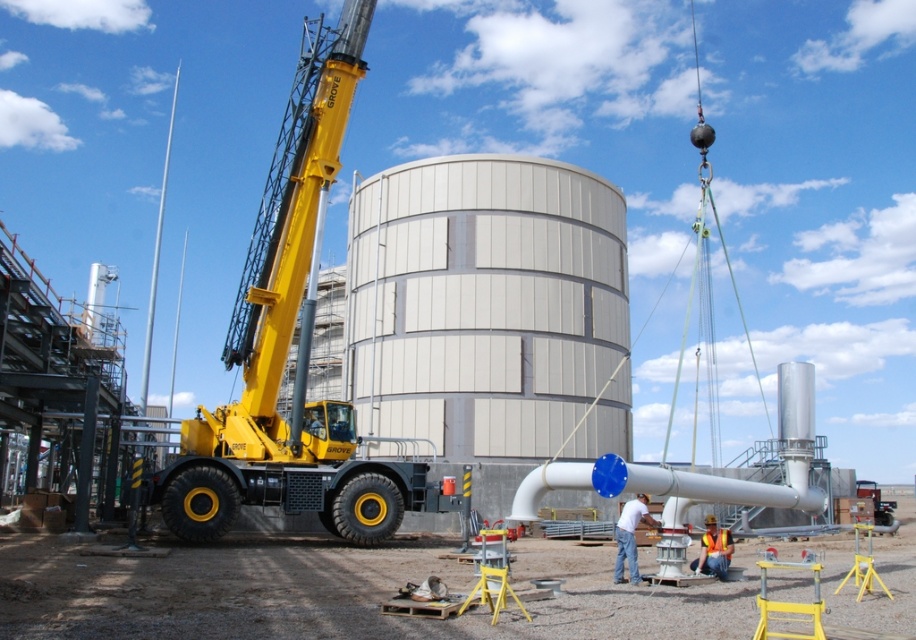
Is point (484, 480) more distant than point (642, 493)?

That is True.

Between point (402, 184) and point (623, 504), which one is positioned behind?

The point (402, 184) is more distant.

This screenshot has width=916, height=640. What are the coordinates of `white smooth silo at center` in the screenshot? It's located at (489, 314).

Between white glossy pipe at center and orange reflective vest at lower center, which one has less height?

orange reflective vest at lower center

Is white glossy pipe at center bigger than orange reflective vest at lower center?

Yes.

At what (x,y) coordinates should I click in order to perform the action: click on white glossy pipe at center. Please return your answer as a coordinate pair (x, y). The image size is (916, 640). Looking at the image, I should click on (667, 484).

At what (x,y) coordinates should I click in order to perform the action: click on white glossy pipe at center. Please return your answer as a coordinate pair (x, y). Looking at the image, I should click on (667, 484).

Can you confirm if yellow metallic crane at left is taller than orange reflective vest at lower center?

Indeed, yellow metallic crane at left has a greater height compared to orange reflective vest at lower center.

Is yellow metallic crane at left positioned before orange reflective vest at lower center?

No, yellow metallic crane at left is further to the viewer.

Measure the distance between yellow metallic crane at left and camera.

yellow metallic crane at left and camera are 60.31 feet apart.

This screenshot has width=916, height=640. Find the location of `yellow metallic crane at left`. yellow metallic crane at left is located at coordinates (289, 344).